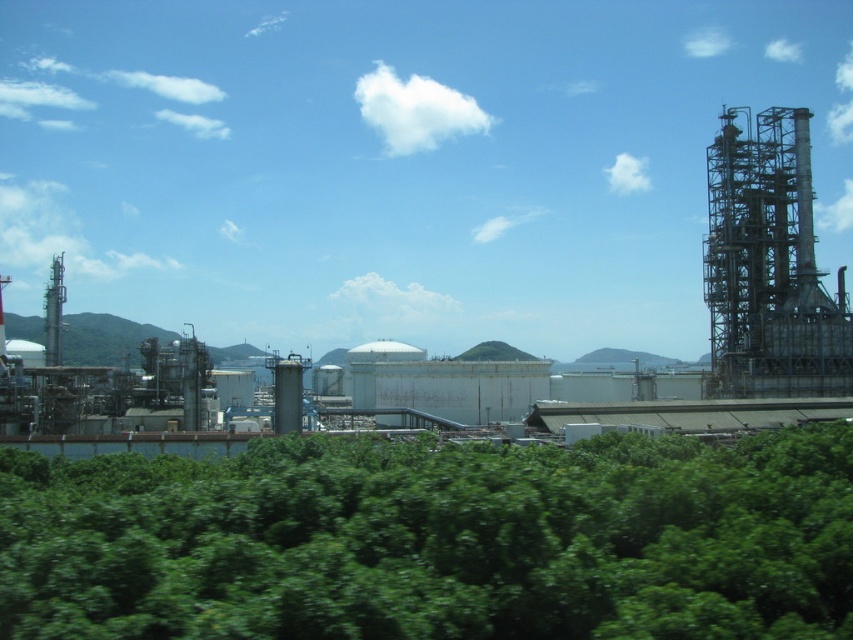
Question: Does green leafy trees at lower center have a larger size compared to metallic gray structure at right?

Choices:
 (A) yes
 (B) no

Answer: (B)

Question: Which point appears farthest from the camera in this image?

Choices:
 (A) (822, 390)
 (B) (294, 604)

Answer: (A)

Question: Among these points, which one is nearest to the camera?

Choices:
 (A) (225, 612)
 (B) (776, 228)

Answer: (A)

Question: Does green leafy trees at lower center appear on the left side of metallic gray structure at right?

Choices:
 (A) yes
 (B) no

Answer: (A)

Question: Where is green leafy trees at lower center located in relation to metallic gray structure at right in the image?

Choices:
 (A) left
 (B) right

Answer: (A)

Question: Which point is closer to the camera taking this photo?

Choices:
 (A) (x=54, y=592)
 (B) (x=769, y=244)

Answer: (A)